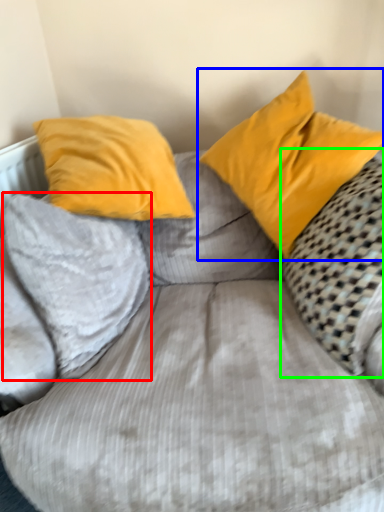
Question: Which object is positioned farthest from pillow (highlighted by a red box)? Select from pillow (highlighted by a blue box) and pillow (highlighted by a green box).

Choices:
 (A) pillow
 (B) pillow

Answer: (B)